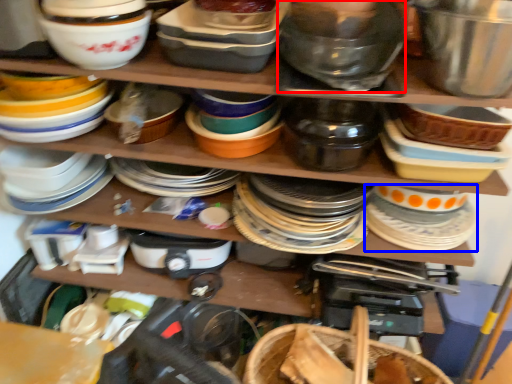
Question: Which object appears closest to the camera in this image, bowl (highlighted by a red box) or tableware (highlighted by a blue box)?

Choices:
 (A) bowl
 (B) tableware

Answer: (A)